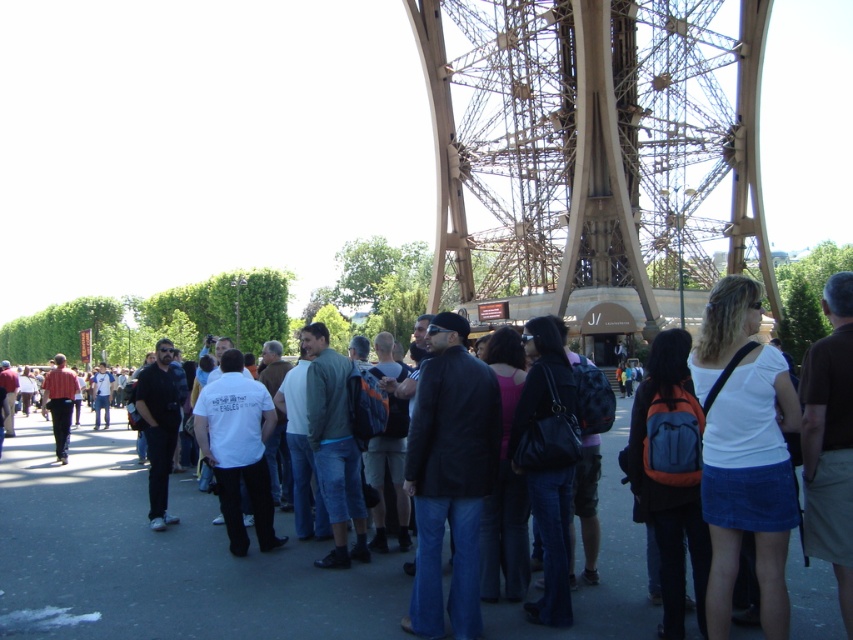
Question: Which is farther from the black leather handbag at center?

Choices:
 (A) white cotton shirt at center
 (B) metallic brown structure at center

Answer: (B)

Question: Which object is closer to the camera taking this photo?

Choices:
 (A) metallic brown structure at center
 (B) dark blue jeans at center

Answer: (B)

Question: Which point is farther from the camera taking this photo?

Choices:
 (A) (544, 358)
 (B) (665, 472)
 (C) (519, 378)
 (D) (519, 129)

Answer: (D)

Question: Is metallic brown structure at center thinner than black leather handbag at center?

Choices:
 (A) yes
 (B) no

Answer: (B)

Question: Is white cotton shirt at center bigger than dark blue jeans at center?

Choices:
 (A) no
 (B) yes

Answer: (B)

Question: In this image, where is orange backpack at center located relative to dark blue jeans at center?

Choices:
 (A) above
 (B) below

Answer: (B)